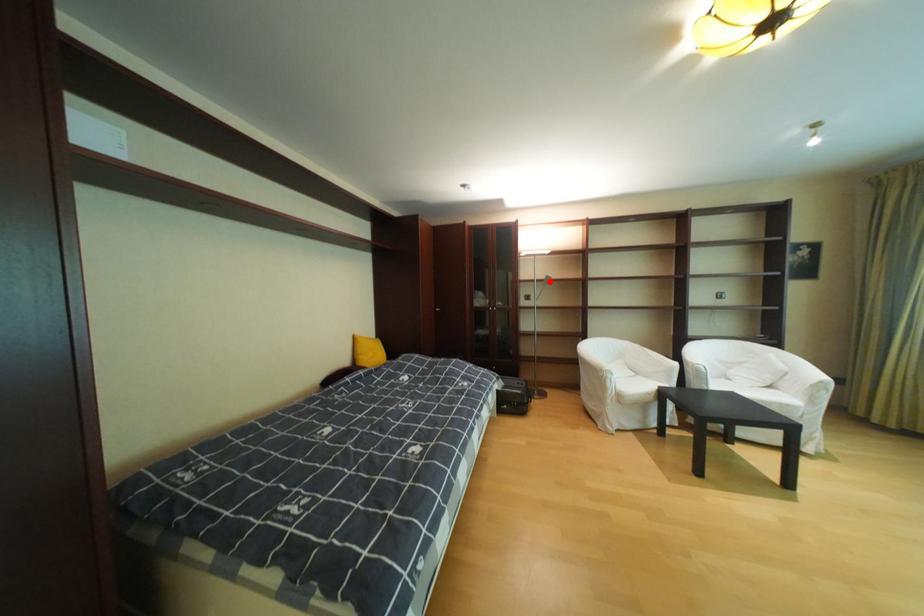
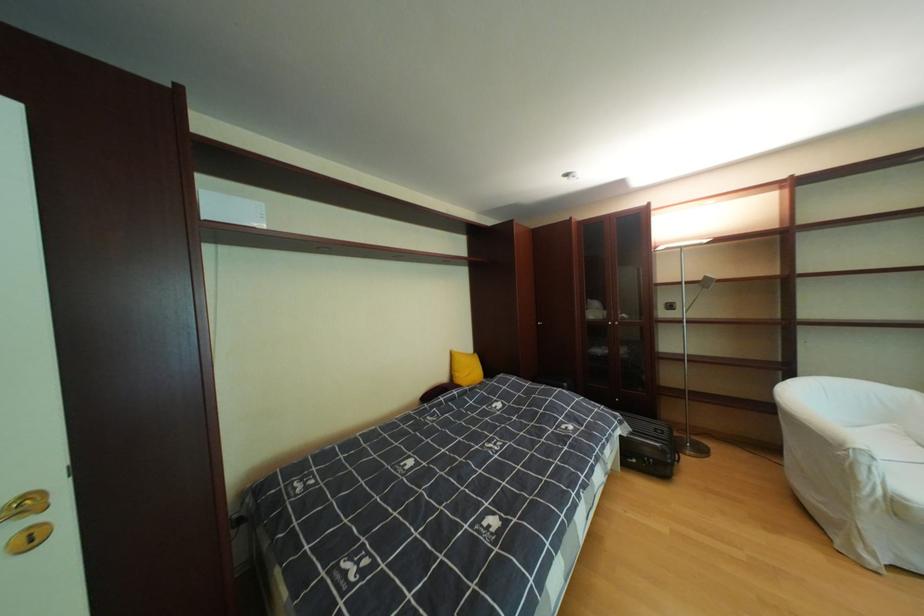
Locate, in the second image, the point that corresponds to the highlighted location in the first image.

(699, 284)